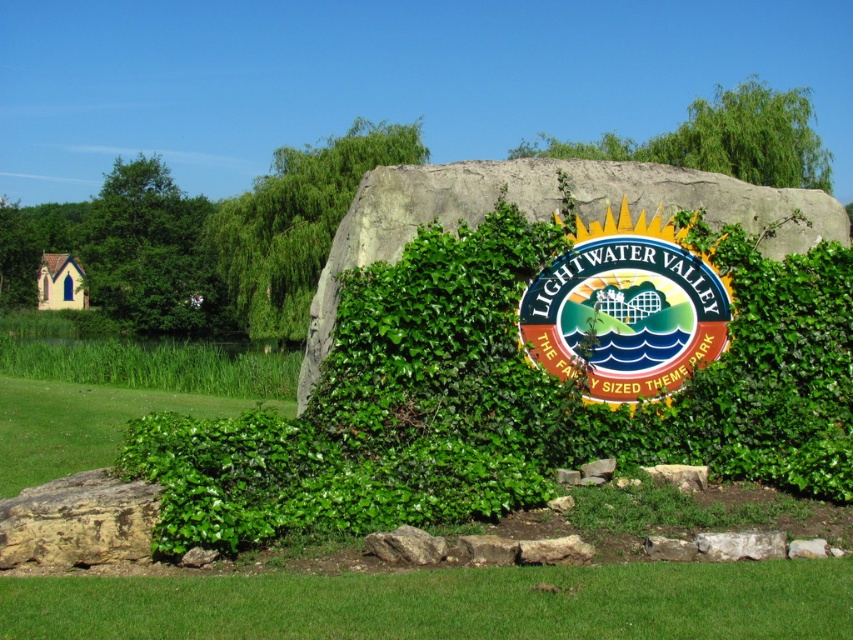
Looking at this image, between green leafy hedge at center and green leafy grass at center, which one appears on the right side from the viewer's perspective?

green leafy hedge at center

Is point (283, 492) positioned behind point (172, 616)?

Yes, it is.

Locate an element on the screen. green leafy hedge at center is located at coordinates (508, 396).

Looking at this image, between metallic gold sign at center and green leafy tree at center, which one is positioned lower?

metallic gold sign at center is lower down.

Who is positioned more to the left, metallic gold sign at center or green leafy tree at center?

Positioned to the left is green leafy tree at center.

The width and height of the screenshot is (853, 640). Find the location of `metallic gold sign at center`. metallic gold sign at center is located at coordinates (625, 308).

From the picture: Between green leafy hedge at center and green grass at lower center, which one has less height?

green grass at lower center is shorter.

Where is `green leafy hedge at center`? green leafy hedge at center is located at coordinates (508, 396).

Identify the location of green leafy hedge at center. The width and height of the screenshot is (853, 640). (508, 396).

Locate an element on the screen. Image resolution: width=853 pixels, height=640 pixels. green leafy hedge at center is located at coordinates (508, 396).